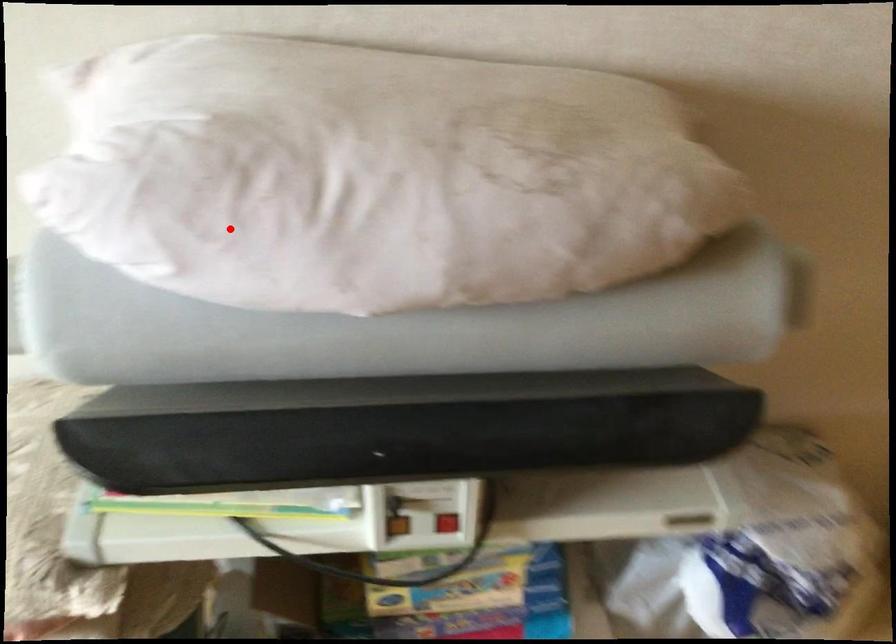
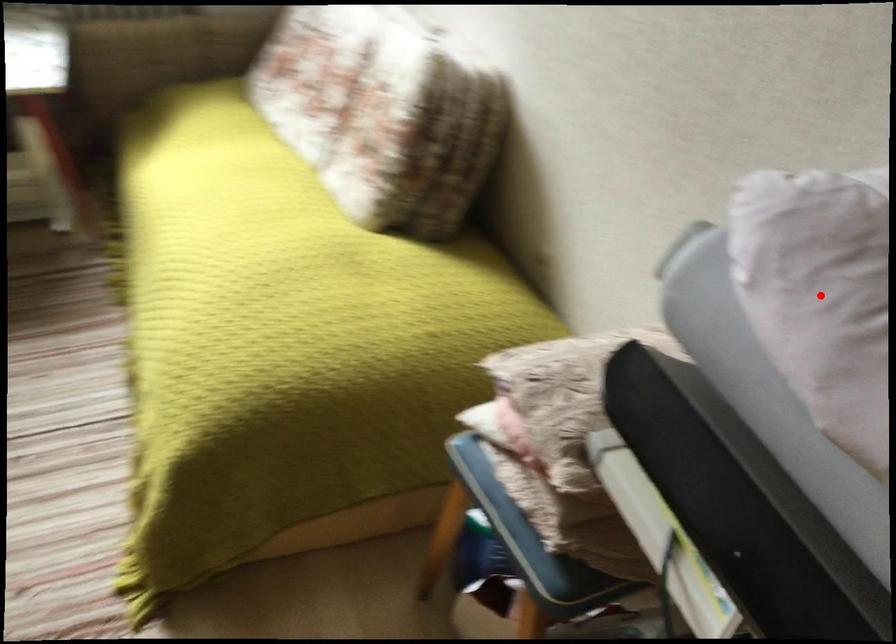
I am providing you with two images of the same scene from different viewpoints. A red point is marked on the first image and another point is marked on the second image. Is the red point in image1 aligned with the point shown in image2?

Yes